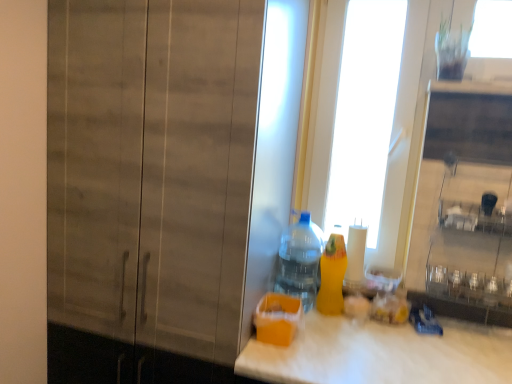
Question: Is yellow matte bottle at right, marked as the 2th bottle in a left-to-right arrangement, located within transparent glass door at upper center?

Choices:
 (A) no
 (B) yes

Answer: (A)

Question: Can you confirm if transparent glass door at upper center is positioned to the right of yellow matte bottle at right, the first bottle viewed from the right?

Choices:
 (A) no
 (B) yes

Answer: (B)

Question: From a real-world perspective, is transparent glass door at upper center beneath yellow matte bottle at right, the first bottle viewed from the right?

Choices:
 (A) yes
 (B) no

Answer: (B)

Question: Is transparent glass door at upper center at the left side of yellow matte bottle at right, marked as the 2th bottle in a left-to-right arrangement?

Choices:
 (A) yes
 (B) no

Answer: (B)

Question: Considering the relative sizes of transparent glass door at upper center and yellow matte bottle at right, the first bottle viewed from the right, in the image provided, is transparent glass door at upper center bigger than yellow matte bottle at right, the first bottle viewed from the right,?

Choices:
 (A) no
 (B) yes

Answer: (B)

Question: Is transparent glass door at upper center taller than yellow matte bottle at right, marked as the 2th bottle in a left-to-right arrangement?

Choices:
 (A) yes
 (B) no

Answer: (A)

Question: Is yellow matte bottle at right, marked as the 2th bottle in a left-to-right arrangement, wider than transparent glass door at upper center?

Choices:
 (A) yes
 (B) no

Answer: (A)

Question: From a real-world perspective, is yellow matte bottle at right, marked as the 2th bottle in a left-to-right arrangement, positioned over transparent glass door at upper center based on gravity?

Choices:
 (A) no
 (B) yes

Answer: (A)

Question: Is yellow matte bottle at right, marked as the 2th bottle in a left-to-right arrangement, closer to camera compared to transparent glass door at upper center?

Choices:
 (A) no
 (B) yes

Answer: (B)

Question: Can you confirm if yellow matte bottle at right, marked as the 2th bottle in a left-to-right arrangement, is smaller than transparent glass door at upper center?

Choices:
 (A) no
 (B) yes

Answer: (B)

Question: From the image's perspective, is yellow matte bottle at right, the first bottle viewed from the right, below transparent glass door at upper center?

Choices:
 (A) yes
 (B) no

Answer: (A)

Question: Is yellow matte bottle at right, marked as the 2th bottle in a left-to-right arrangement, in contact with transparent glass door at upper center?

Choices:
 (A) no
 (B) yes

Answer: (A)

Question: From a real-world perspective, does translucent plastic bottle at center, the 2th bottle from the right, sit lower than transparent glass door at upper center?

Choices:
 (A) no
 (B) yes

Answer: (B)